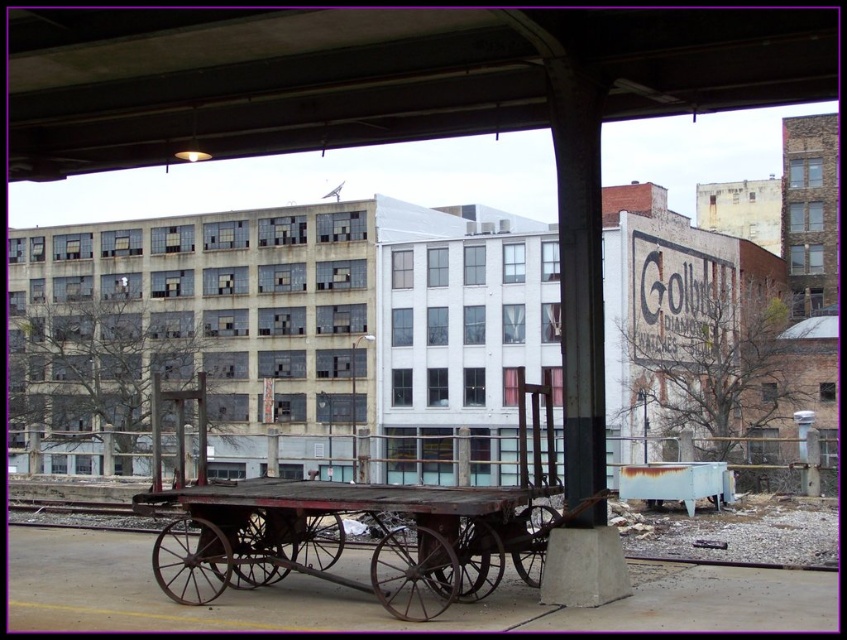
The image size is (847, 640). What do you see at coordinates (377, 76) in the screenshot?
I see `concrete ceiling at upper center` at bounding box center [377, 76].

Which is in front, point (358, 60) or point (40, 512)?

Point (358, 60)

At what (x,y) coordinates should I click in order to perform the action: click on concrete ceiling at upper center. Please return your answer as a coordinate pair (x, y). This screenshot has height=640, width=847. Looking at the image, I should click on (377, 76).